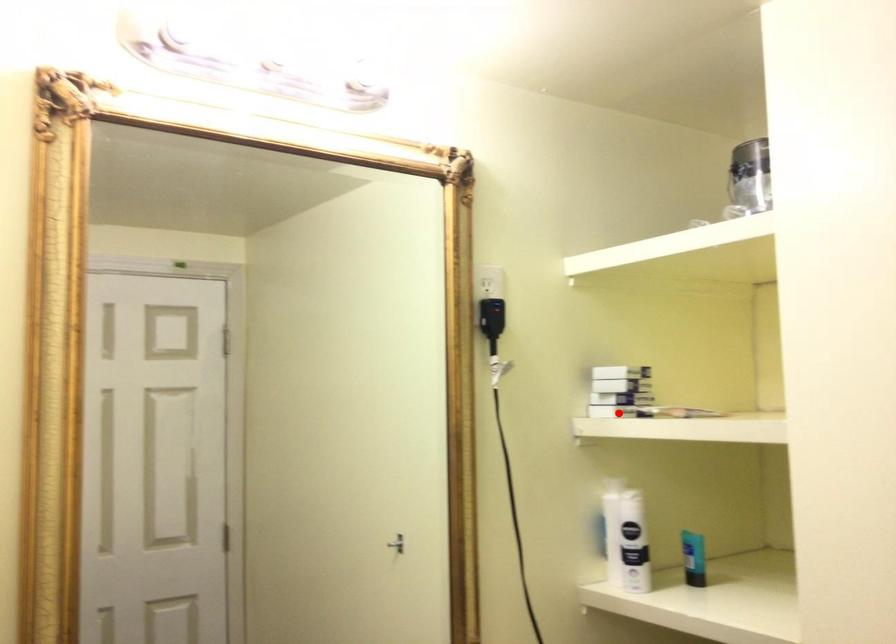
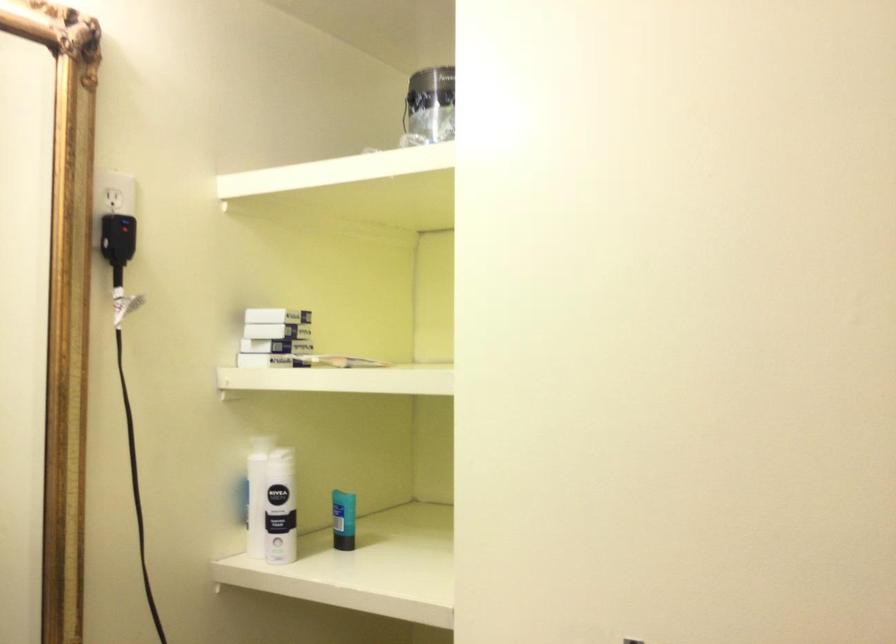
Question: I am providing you with two images of the same scene from different viewpoints. A red point is marked on the first image. Is the red point's position out of view in image 2?

Choices:
 (A) Yes
 (B) No

Answer: (B)